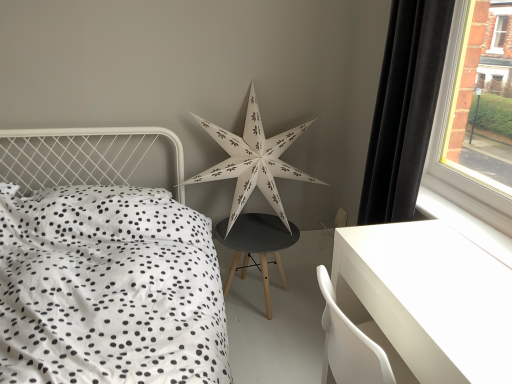
Consider the image. Measure the distance between point (x=272, y=238) and camera.

Point (x=272, y=238) and camera are 7.30 feet apart from each other.

This screenshot has height=384, width=512. What do you see at coordinates (465, 225) in the screenshot?
I see `white smooth window sill at lower right` at bounding box center [465, 225].

The width and height of the screenshot is (512, 384). What do you see at coordinates (429, 298) in the screenshot? I see `white glossy table at lower right` at bounding box center [429, 298].

At what (x,y) coordinates should I click in order to perform the action: click on black matte stool at center. Please return your answer as a coordinate pair (x, y). Looking at the image, I should click on [256, 246].

Which of these two, white paper star at center or black matte stool at center, is smaller?

Smaller between the two is black matte stool at center.

Considering the relative positions of white paper star at center and black matte stool at center in the image provided, is white paper star at center to the right of black matte stool at center from the viewer's perspective?

In fact, white paper star at center is to the left of black matte stool at center.

Considering the sizes of objects white paper star at center and black matte stool at center in the image provided, who is wider, white paper star at center or black matte stool at center?

Wider between the two is black matte stool at center.

The height and width of the screenshot is (384, 512). Identify the location of star on the left of black matte stool at center. (253, 161).

Considering the sizes of black matte stool at center and black velvet curtain at right in the image, is black matte stool at center bigger or smaller than black velvet curtain at right?

Considering their sizes, black matte stool at center takes up more space than black velvet curtain at right.

Is black velvet curtain at right surrounded by black matte stool at center?

No, black velvet curtain at right is not inside black matte stool at center.

Is black matte stool at center oriented away from black velvet curtain at right?

No.

From the image's perspective, would you say white smooth window sill at lower right is shown under white dotted fabric at left?

Actually, white smooth window sill at lower right appears above white dotted fabric at left in the image.

This screenshot has height=384, width=512. What are the coordinates of `bed that is in front of the white smooth window sill at lower right` in the screenshot? It's located at (103, 266).

From a real-world perspective, who is located higher, white smooth window sill at lower right or white dotted fabric at left?

white smooth window sill at lower right.

Which is nearer, (251, 156) or (365, 196)?

Positioned in front is point (365, 196).

From a real-world perspective, between white paper star at center and black velvet curtain at right, who is vertically higher?

black velvet curtain at right.

I want to click on curtain located above the white paper star at center (from the image's perspective), so click(x=404, y=109).

Could you tell me if white paper star at center is turned towards black velvet curtain at right?

Yes, white paper star at center is facing black velvet curtain at right.

How different are the orientations of white dotted fabric at left and white smooth window sill at lower right in degrees?

white dotted fabric at left and white smooth window sill at lower right are facing 89 degrees away from each other.

Could you tell me if white dotted fabric at left is facing white smooth window sill at lower right?

No, white dotted fabric at left is not aimed at white smooth window sill at lower right.

Considering the sizes of objects white dotted fabric at left and white smooth window sill at lower right in the image provided, who is bigger, white dotted fabric at left or white smooth window sill at lower right?

white dotted fabric at left.

Is white dotted fabric at left positioned far away from white smooth window sill at lower right?

Yes.

Does point (28, 232) come in front of point (422, 154)?

No.

Can you confirm if white dotted fabric at left is positioned to the right of black velvet curtain at right?

No, white dotted fabric at left is not to the right of black velvet curtain at right.

Does white dotted fabric at left have a lesser width compared to black velvet curtain at right?

In fact, white dotted fabric at left might be wider than black velvet curtain at right.

Is white dotted fabric at left oriented towards black velvet curtain at right?

No, white dotted fabric at left does not turn towards black velvet curtain at right.

Is black velvet curtain at right positioned in front of black matte stool at center?

Yes, the depth of black velvet curtain at right is less than that of black matte stool at center.

Which point is more distant from viewer, (x=365, y=175) or (x=226, y=228)?

Point (x=226, y=228)

Looking at the image, does black velvet curtain at right seem bigger or smaller compared to black matte stool at center?

Considering their sizes, black velvet curtain at right takes up less space than black matte stool at center.

Which of these two, black velvet curtain at right or black matte stool at center, stands taller?

Standing taller between the two is black velvet curtain at right.

You are a GUI agent. You are given a task and a screenshot of the screen. Output one action in this format:
    pyautogui.click(x=<x>, y=<y>)
    Task: Click on the star above the black matte stool at center (from the image's perspective)
    This screenshot has width=512, height=384.
    Given the screenshot: What is the action you would take?
    pyautogui.click(x=253, y=161)

Identify the location of curtain located on the right of black matte stool at center. This screenshot has width=512, height=384. (404, 109).

Looking at the image, which one is located closer to white glossy table at lower right, white smooth window sill at lower right or white dotted fabric at left?

Answer: Among the two, white smooth window sill at lower right is located nearer to white glossy table at lower right.

From the image, which object appears to be nearer to black matte stool at center, black velvet curtain at right or white dotted fabric at left?

Among the two, white dotted fabric at left is located nearer to black matte stool at center.

Estimate the real-world distances between objects in this image. Which object is closer to white dotted fabric at left, black matte stool at center or white glossy table at lower right?

Based on the image, black matte stool at center appears to be nearer to white dotted fabric at left.

Estimate the real-world distances between objects in this image. Which object is closer to black matte stool at center, white smooth window sill at lower right or white paper star at center?

white paper star at center is closer to black matte stool at center.

Looking at the image, which one is located closer to white smooth window sill at lower right, white paper star at center or white glossy table at lower right?

Based on the image, white glossy table at lower right appears to be nearer to white smooth window sill at lower right.

From the image, which object appears to be farther from white smooth window sill at lower right, white dotted fabric at left or black velvet curtain at right?

white dotted fabric at left lies further to white smooth window sill at lower right than the other object.

When comparing their distances from white glossy table at lower right, does white paper star at center or white dotted fabric at left seem closer?

Result: white dotted fabric at left is closer to white glossy table at lower right.

When comparing their distances from black velvet curtain at right, does white paper star at center or white smooth window sill at lower right seem closer?

white smooth window sill at lower right lies closer to black velvet curtain at right than the other object.

Locate an element on the screen. The width and height of the screenshot is (512, 384). curtain located between white dotted fabric at left and white smooth window sill at lower right in the left-right direction is located at coordinates (404, 109).

Find the location of a particular element. The width and height of the screenshot is (512, 384). curtain between white dotted fabric at left and white paper star at center in the front-back direction is located at coordinates (404, 109).

Where is `curtain located between white paper star at center and white smooth window sill at lower right in the left-right direction`? curtain located between white paper star at center and white smooth window sill at lower right in the left-right direction is located at coordinates (404, 109).

What are the coordinates of `curtain positioned between white glossy table at lower right and white paper star at center from near to far` in the screenshot? It's located at (404, 109).